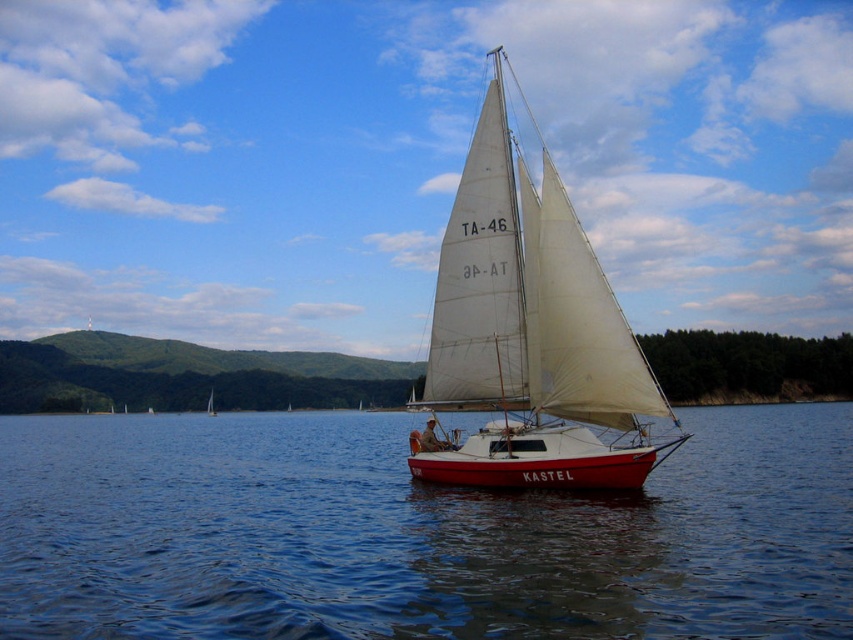
Is white canvas sailboat at center closer to camera compared to white sailboat at center?

That is True.

Is white canvas sailboat at center taller than white sailboat at center?

Indeed, white canvas sailboat at center has a greater height compared to white sailboat at center.

This screenshot has height=640, width=853. Identify the location of white canvas sailboat at center. (531, 333).

Can you confirm if smooth blue water at center is positioned above white canvas sailboat at center?

Actually, smooth blue water at center is below white canvas sailboat at center.

Can you confirm if smooth blue water at center is bigger than white canvas sailboat at center?

No.

Does point (102, 465) come in front of point (602, 275)?

That is False.

Image resolution: width=853 pixels, height=640 pixels. I want to click on smooth blue water at center, so click(415, 532).

Does smooth blue water at center appear on the right side of white sailboat at center?

Yes, smooth blue water at center is to the right of white sailboat at center.

Who is shorter, smooth blue water at center or white sailboat at center?

With less height is white sailboat at center.

Where is `smooth blue water at center`? smooth blue water at center is located at coordinates (415, 532).